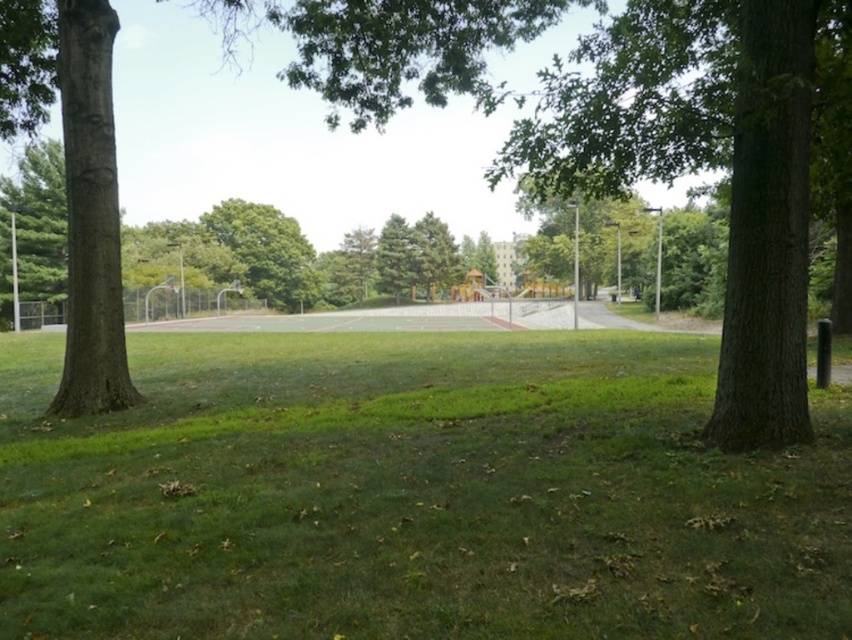
You are standing at the center of the basketball court and want to walk directly to the green grassy area at center. Which direction should you walk?

Since the green grassy area at center is located at point (x=413, y=496), you should walk towards the center of the image to reach it.

You are standing at the point with coordinates point (384, 584) and want to walk towards the point with coordinates point (116, 236). Which direction should you face to walk directly towards it?

Since point (384, 584) is in front of point (116, 236), you should face the direction opposite to the current position to walk towards point (116, 236).

You are standing at the edge of the basketball court and want to walk to the playground. Which direction should you go relative to the brown rough tree at center and the green grassy area at center?

Since the green grassy area at center is to the right of the brown rough tree at center, you should head towards the right side of the brown rough tree at center or the left side of the green grassy area at center to reach the playground.